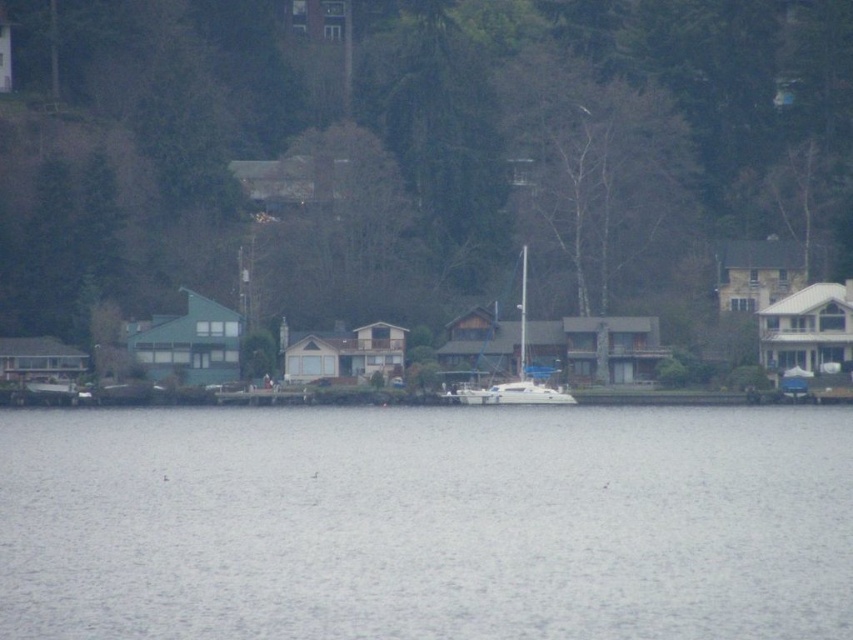
Does gray water at center have a greater height compared to white glossy sailboat at center?

No.

Does gray water at center have a larger size compared to white glossy sailboat at center?

Correct, gray water at center is larger in size than white glossy sailboat at center.

Find the location of a particular element. gray water at center is located at coordinates (426, 524).

The image size is (853, 640). Find the location of `gray water at center`. gray water at center is located at coordinates (426, 524).